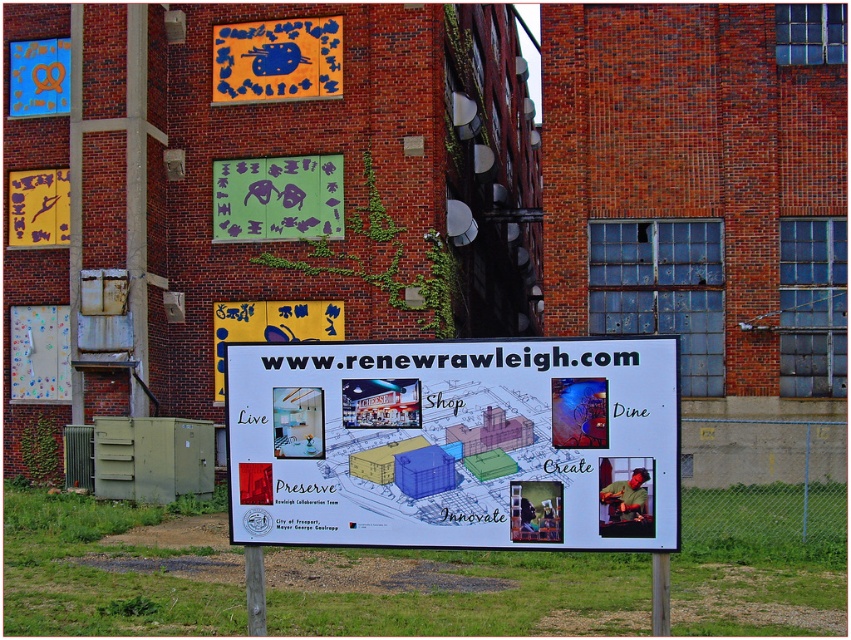
Does white paper sign at center have a greater height compared to yellow matte sign at center?

Incorrect, white paper sign at center's height is not larger of yellow matte sign at center's.

In the scene shown: Which of these two, white paper sign at center or yellow matte sign at center, stands shorter?

white paper sign at center is shorter.

At what (x,y) coordinates should I click in order to perform the action: click on white paper sign at center. Please return your answer as a coordinate pair (x, y). Looking at the image, I should click on 454,444.

Is green matte sign at center thinner than yellow matte sign at center?

Indeed, green matte sign at center has a lesser width compared to yellow matte sign at center.

This screenshot has height=640, width=851. Describe the element at coordinates (277, 198) in the screenshot. I see `green matte sign at center` at that location.

The image size is (851, 640). In order to click on green matte sign at center in this screenshot , I will do `click(277, 198)`.

Can you confirm if matte blue pretzel at upper left is shorter than yellow matte sign at upper left?

No, matte blue pretzel at upper left is not shorter than yellow matte sign at upper left.

Is matte blue pretzel at upper left below yellow matte sign at upper left?

No, matte blue pretzel at upper left is not below yellow matte sign at upper left.

Is point (67, 96) farther from camera compared to point (61, 195)?

Yes, point (67, 96) is behind point (61, 195).

Identify the location of matte blue pretzel at upper left. The width and height of the screenshot is (851, 640). (38, 77).